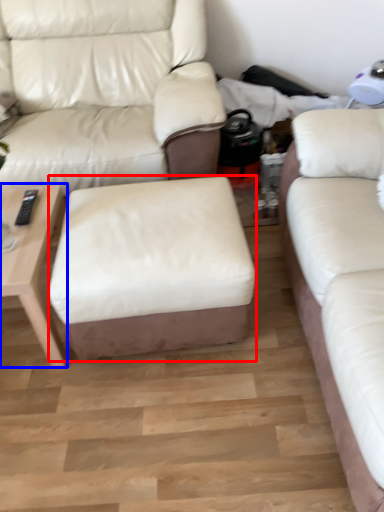
Question: Which object is closer to the camera taking this photo, stool (highlighted by a red box) or table (highlighted by a blue box)?

Choices:
 (A) stool
 (B) table

Answer: (A)